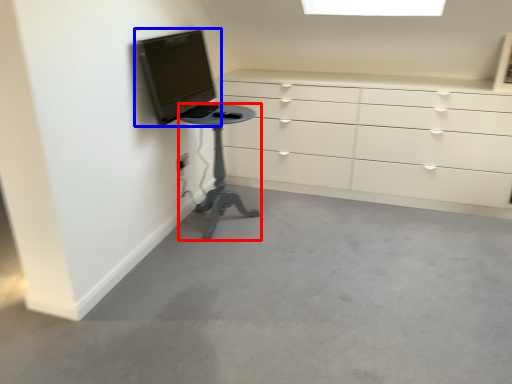
Question: Which object is further to the camera taking this photo, furniture (highlighted by a red box) or television (highlighted by a blue box)?

Choices:
 (A) furniture
 (B) television

Answer: (A)